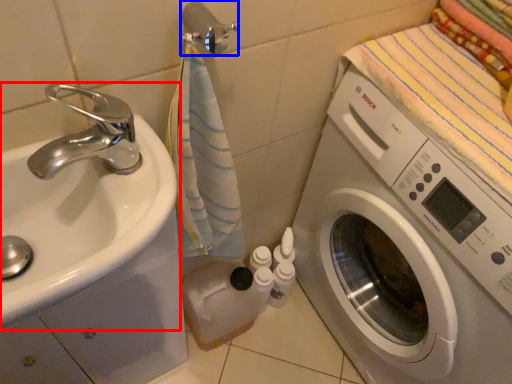
Question: Which object appears farthest to the camera in this image, sink (highlighted by a red box) or towel bar (highlighted by a blue box)?

Choices:
 (A) sink
 (B) towel bar

Answer: (B)